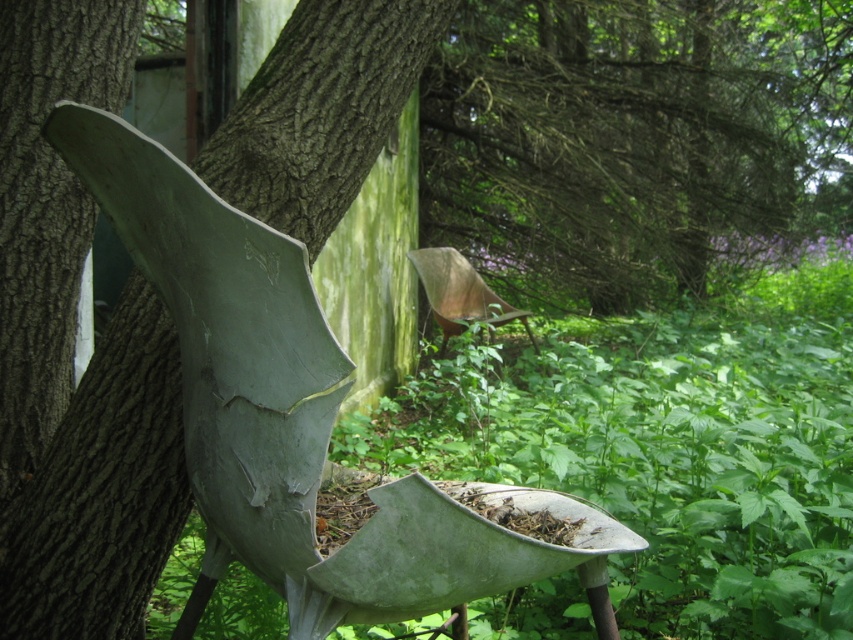
Does green rough bark tree trunk at left appear on the left side of matte gray bird feeder at center?

Yes, green rough bark tree trunk at left is to the left of matte gray bird feeder at center.

Can you confirm if green rough bark tree trunk at left is positioned above matte gray bird feeder at center?

Yes, green rough bark tree trunk at left is above matte gray bird feeder at center.

Describe the element at coordinates (102, 490) in the screenshot. This screenshot has width=853, height=640. I see `green rough bark tree trunk at left` at that location.

Locate an element on the screen. green rough bark tree trunk at left is located at coordinates (102, 490).